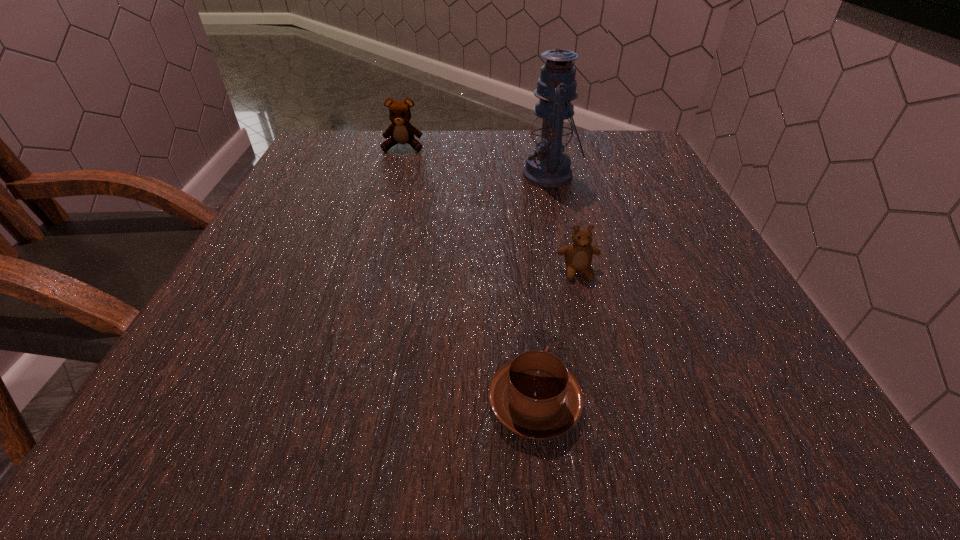
At what (x,y) coordinates should I click in order to perform the action: click on vacant space at the near edge of the desktop. Please return your answer as a coordinate pair (x, y). This screenshot has width=960, height=540. Looking at the image, I should click on (370, 417).

The height and width of the screenshot is (540, 960). What are the coordinates of `vacant space at the left edge of the desktop` in the screenshot? It's located at (281, 236).

At what (x,y) coordinates should I click in order to perform the action: click on vacant area at the right edge of the desktop. Please return your answer as a coordinate pair (x, y). The image size is (960, 540). Looking at the image, I should click on tap(677, 206).

In the image, there is a desktop. Where is `vacant region at the far right corner`? Image resolution: width=960 pixels, height=540 pixels. vacant region at the far right corner is located at coordinates point(615,142).

This screenshot has width=960, height=540. Find the location of `unoccupied area between the nearest object and the tallest object`. unoccupied area between the nearest object and the tallest object is located at coordinates (542, 289).

Find the location of a particular element. This screenshot has height=540, width=960. free space that is in between the left teddy bear and the right teddy bear is located at coordinates (491, 209).

This screenshot has width=960, height=540. What are the coordinates of `vacant region between the nearest object and the farthest object` in the screenshot? It's located at pyautogui.click(x=468, y=275).

This screenshot has width=960, height=540. Identify the location of free point between the right teddy bear and the lantern. 564,224.

This screenshot has width=960, height=540. Identify the location of empty space that is in between the farther teddy bear and the cappuccino. (468, 275).

Find the location of `free spot between the cappuccino and the third nearest object`. free spot between the cappuccino and the third nearest object is located at coordinates [x=542, y=289].